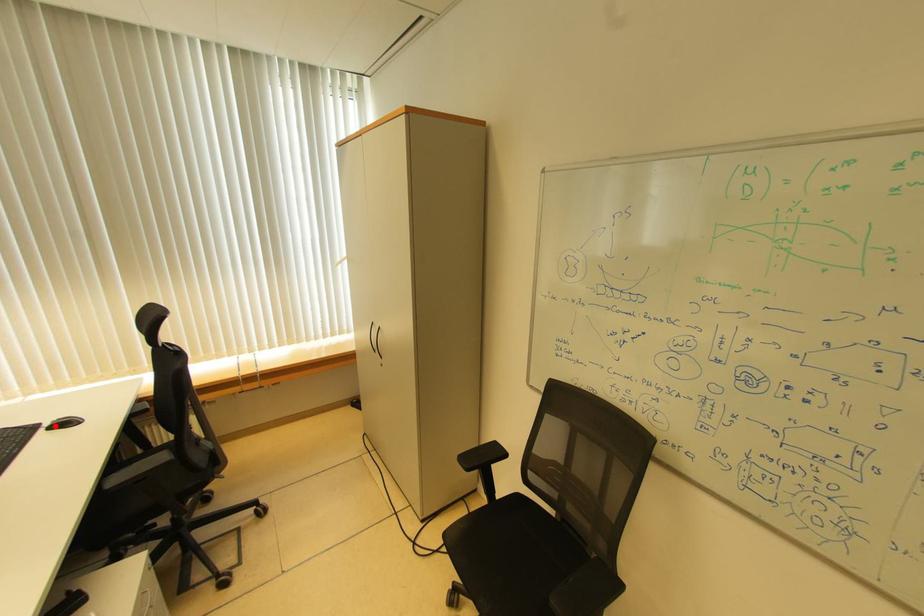
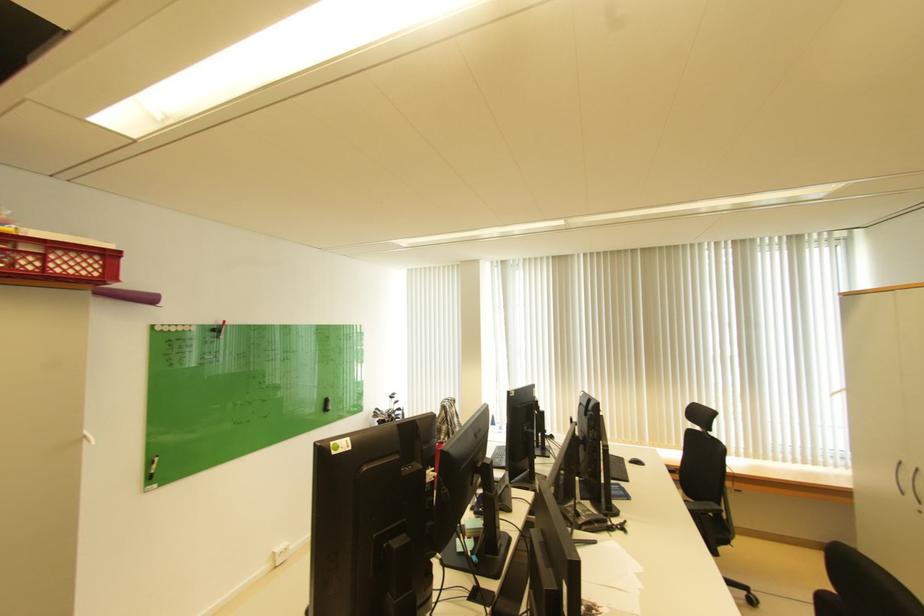
In the second image, find the point that corresponds to the highlighted location in the first image.

(638, 461)